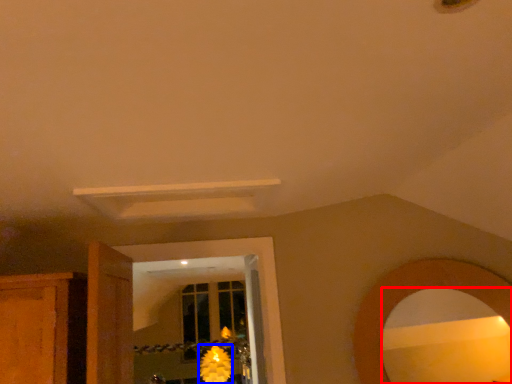
Question: Which point is further to the camera, mirror (highlighted by a red box) or flower (highlighted by a blue box)?

Choices:
 (A) mirror
 (B) flower

Answer: (B)